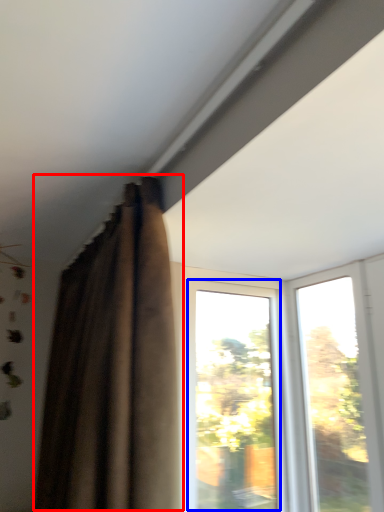
Question: Which point is further to the camera, curtain (highlighted by a red box) or window (highlighted by a blue box)?

Choices:
 (A) curtain
 (B) window

Answer: (B)